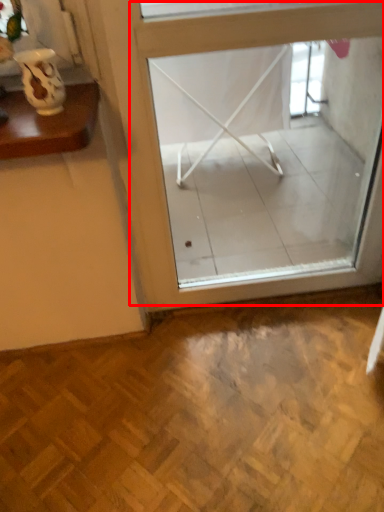
Question: From the image's perspective, where is window (annotated by the red box) located in relation to vase in the image?

Choices:
 (A) above
 (B) below

Answer: (B)